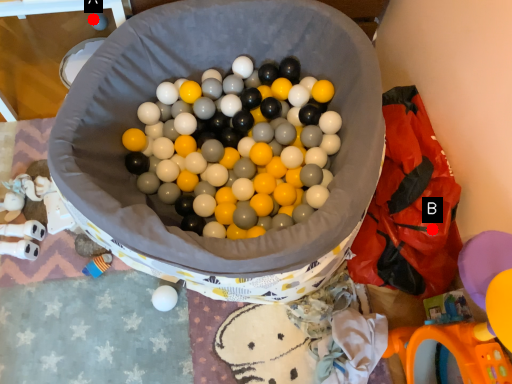
Question: Two points are circled on the image, labeled by A and B beside each circle. Which point appears closest to the camera in this image?

Choices:
 (A) A is closer
 (B) B is closer

Answer: (B)